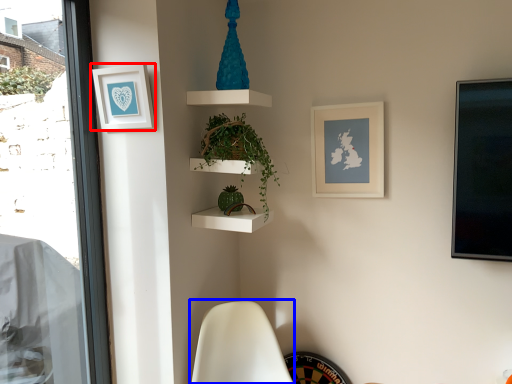
Question: Among these objects, which one is farthest to the camera, picture frame (highlighted by a red box) or swivel chair (highlighted by a blue box)?

Choices:
 (A) picture frame
 (B) swivel chair

Answer: (A)